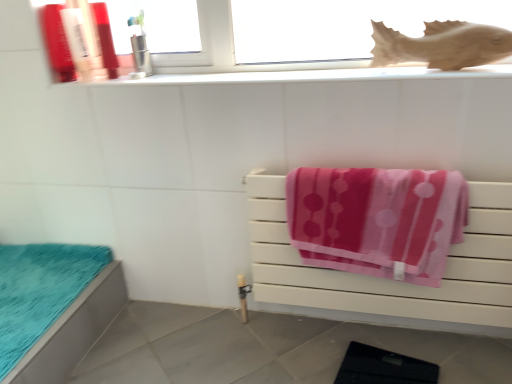
This screenshot has height=384, width=512. Identify the location of free spot to the left of pink fabric towel at center. (231, 344).